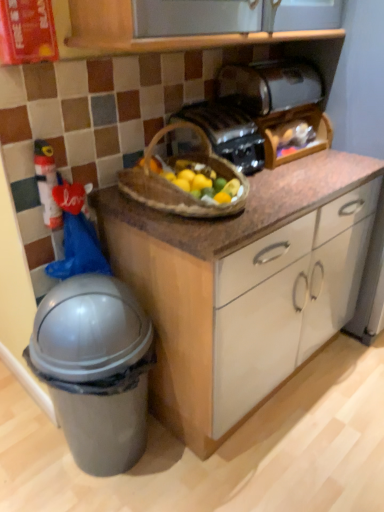
Question: Is satin black toaster at upper center, marked as the first toaster in a top-to-bottom arrangement, at the back of matte black toaster at center, the 2th toaster when ordered from top to bottom?

Choices:
 (A) yes
 (B) no

Answer: (B)

Question: Is matte black toaster at center, the 2th toaster when ordered from top to bottom, surrounding satin black toaster at upper center, acting as the 2th toaster starting from the bottom?

Choices:
 (A) no
 (B) yes

Answer: (A)

Question: Is matte black toaster at center, the 2th toaster when ordered from top to bottom, facing towards satin black toaster at upper center, acting as the 2th toaster starting from the bottom?

Choices:
 (A) yes
 (B) no

Answer: (B)

Question: Does matte black toaster at center, the 1th toaster from the bottom, have a lesser width compared to satin black toaster at upper center, marked as the first toaster in a top-to-bottom arrangement?

Choices:
 (A) no
 (B) yes

Answer: (A)

Question: Does matte black toaster at center, the 1th toaster from the bottom, have a smaller size compared to satin black toaster at upper center, marked as the first toaster in a top-to-bottom arrangement?

Choices:
 (A) no
 (B) yes

Answer: (B)

Question: Is gray plastic trash can at lower left bigger or smaller than brown woven picnic basket at center?

Choices:
 (A) small
 (B) big

Answer: (B)

Question: Choose the correct answer: Is gray plastic trash can at lower left inside brown woven picnic basket at center or outside it?

Choices:
 (A) inside
 (B) outside

Answer: (B)

Question: From a real-world perspective, is gray plastic trash can at lower left positioned above or below brown woven picnic basket at center?

Choices:
 (A) above
 (B) below

Answer: (B)

Question: Considering the relative positions of gray plastic trash can at lower left and brown woven picnic basket at center in the image provided, is gray plastic trash can at lower left to the left or to the right of brown woven picnic basket at center?

Choices:
 (A) left
 (B) right

Answer: (A)

Question: Is brown woven picnic basket at center inside the boundaries of gray plastic trash can at lower left, or outside?

Choices:
 (A) inside
 (B) outside

Answer: (B)

Question: In terms of width, does brown woven picnic basket at center look wider or thinner when compared to gray plastic trash can at lower left?

Choices:
 (A) thin
 (B) wide

Answer: (B)

Question: From a real-world perspective, is brown woven picnic basket at center above or below gray plastic trash can at lower left?

Choices:
 (A) below
 (B) above

Answer: (B)

Question: Is point (119, 175) closer or farther from the camera than point (51, 311)?

Choices:
 (A) closer
 (B) farther

Answer: (B)

Question: From the image's perspective, relative to brown woven picnic basket at center, is plastic fire extinguisher at left above or below?

Choices:
 (A) above
 (B) below

Answer: (B)

Question: Is plastic fire extinguisher at left taller or shorter than brown woven picnic basket at center?

Choices:
 (A) tall
 (B) short

Answer: (A)